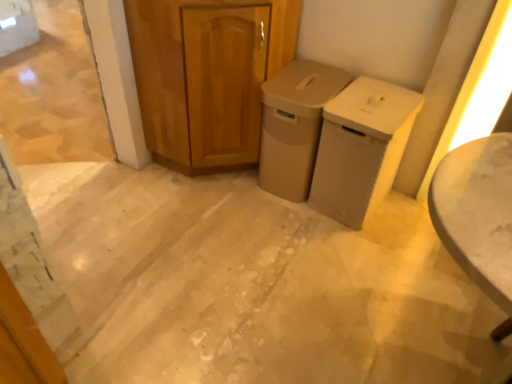
I want to click on free space in front of beige matte trash can at center, positioned as the 2th waste container in right-to-left order, so click(288, 225).